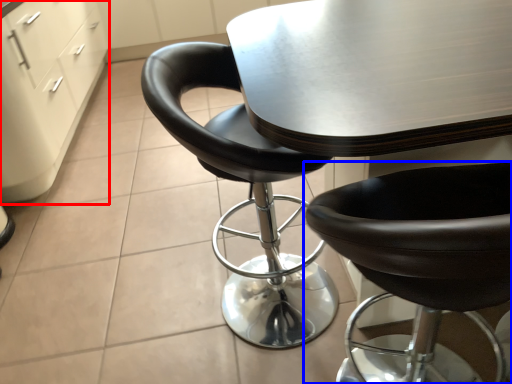
Question: Which object is further to the camera taking this photo, file cabinet (highlighted by a red box) or chair (highlighted by a blue box)?

Choices:
 (A) file cabinet
 (B) chair

Answer: (A)